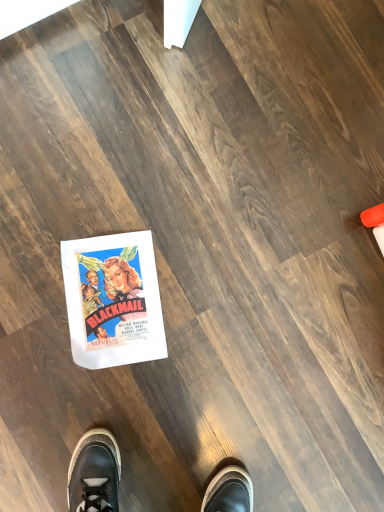
You are a GUI agent. You are given a task and a screenshot of the screen. Output one action in this format:
    pyautogui.click(x=<x>, y=<y>)
    Task: Click on the free spot to the right of white paper at center
    
    Given the screenshot: What is the action you would take?
    pyautogui.click(x=190, y=369)